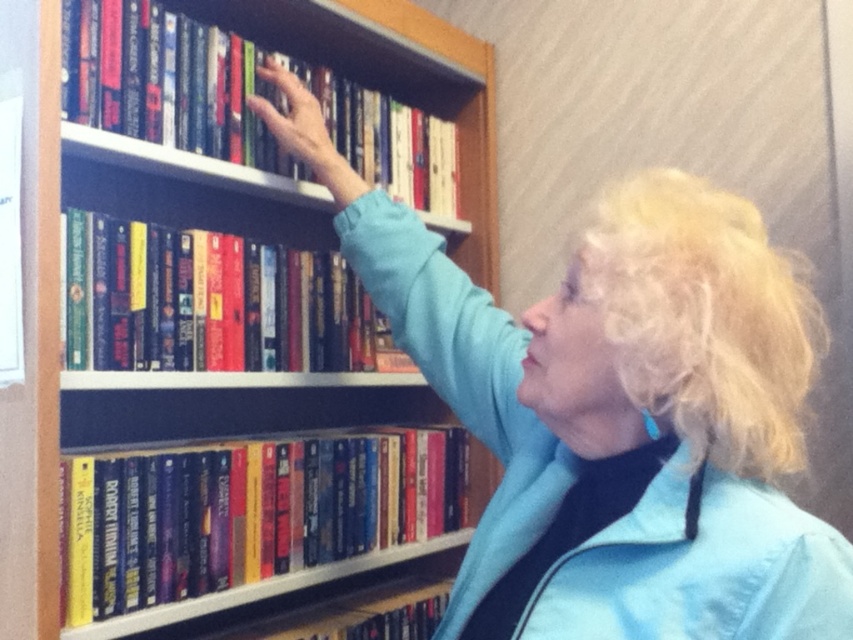
Question: Can you confirm if hardcover book at center is positioned to the right of hardcover book at upper center?

Choices:
 (A) no
 (B) yes

Answer: (B)

Question: Does blue denim jacket at upper right have a greater width compared to wooden bookshelf at upper center?

Choices:
 (A) no
 (B) yes

Answer: (B)

Question: Is wooden bookshelf at upper center below hardcover book at upper left?

Choices:
 (A) yes
 (B) no

Answer: (B)

Question: Which object is positioned farthest from the hardcover book at upper left?

Choices:
 (A) hardcover book at center
 (B) hardcover book at upper center
 (C) blue denim jacket at upper right

Answer: (C)

Question: Which of these objects is positioned closest to the wooden bookshelf at upper center?

Choices:
 (A) hardcover book at upper center
 (B) blue denim jacket at upper right
 (C) hardcover book at center

Answer: (A)

Question: Which point is farther from the camera taking this photo?

Choices:
 (A) (320, 392)
 (B) (190, 570)
 (C) (494, 432)

Answer: (A)